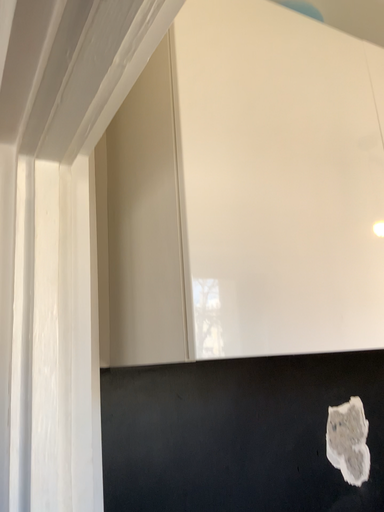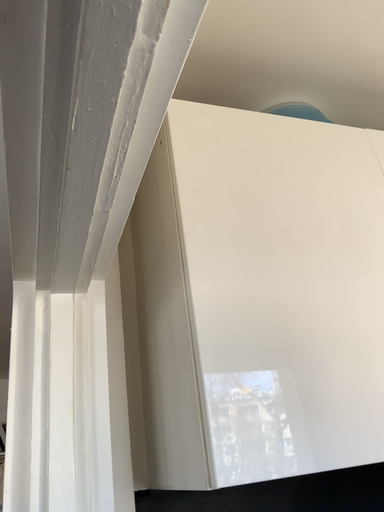
Question: How did the camera likely rotate when shooting the video?

Choices:
 (A) rotated left
 (B) rotated right

Answer: (A)